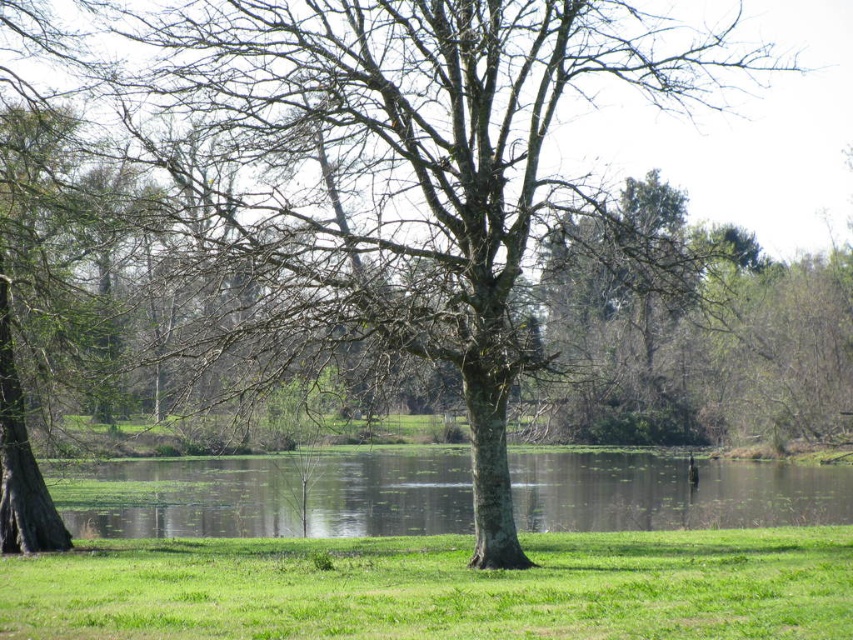
Based on the photo, can you confirm if green grassy at center is thinner than green reflective water at center?

Correct, green grassy at center's width is less than green reflective water at center's.

Does green grassy at center have a larger size compared to green reflective water at center?

No.

Measure the distance between green grassy at center and camera.

They are 10.93 meters apart.

Where is `green grassy at center`? green grassy at center is located at coordinates (440, 588).